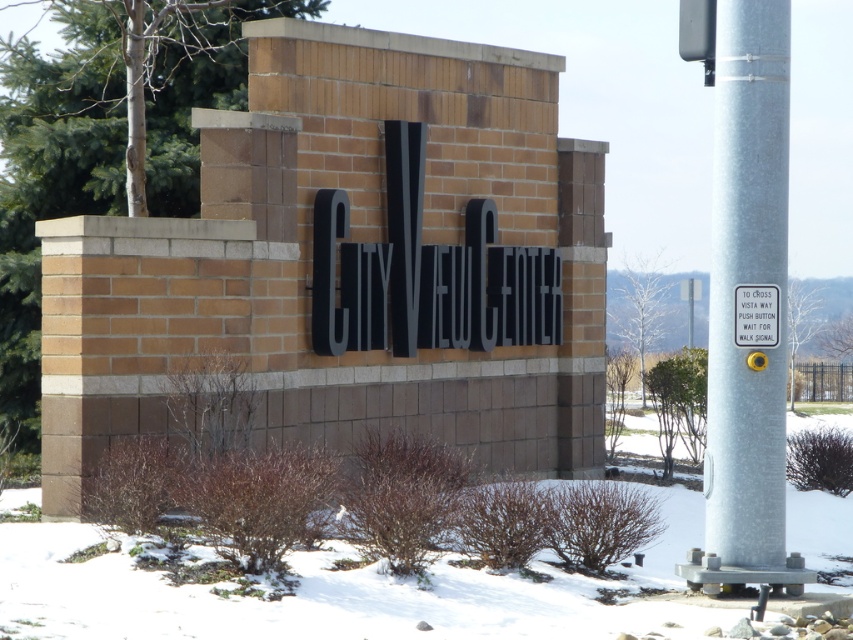
Question: Which point appears closest to the camera in this image?

Choices:
 (A) (444, 627)
 (B) (741, 316)

Answer: (A)

Question: Which of the following is the farthest from the observer?

Choices:
 (A) (207, 548)
 (B) (772, 346)
 (C) (763, 243)

Answer: (A)

Question: Does silver metallic pole at right have a smaller size compared to white plastic sign at upper right?

Choices:
 (A) no
 (B) yes

Answer: (A)

Question: Does silver metallic pole at right have a smaller size compared to white plastic sign at upper right?

Choices:
 (A) no
 (B) yes

Answer: (A)

Question: Which point is closer to the camera taking this photo?

Choices:
 (A) pyautogui.click(x=744, y=483)
 (B) pyautogui.click(x=627, y=611)
 (C) pyautogui.click(x=759, y=294)

Answer: (B)

Question: Is white powdery snow at center bigger than silver metallic pole at right?

Choices:
 (A) yes
 (B) no

Answer: (A)